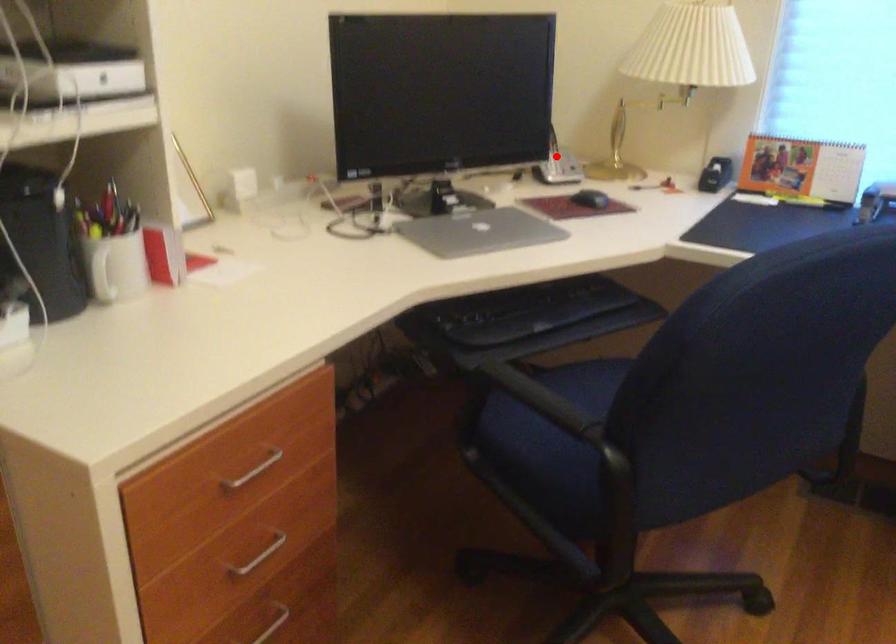
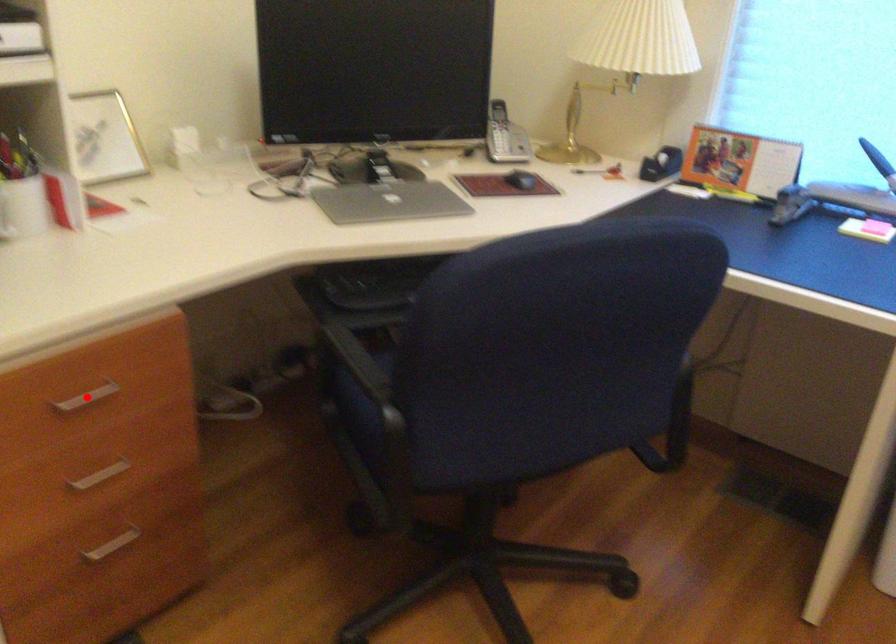
I am providing you with two images of the same scene from different viewpoints. A red point is marked on the first image and another point is marked on the second image. Are the points marked in image1 and image2 representing the same 3D position?

No